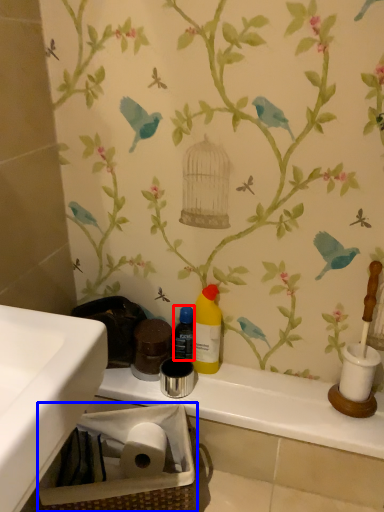
Question: Which point is further to the camera, bottle (highlighted by a red box) or basket (highlighted by a blue box)?

Choices:
 (A) bottle
 (B) basket

Answer: (A)